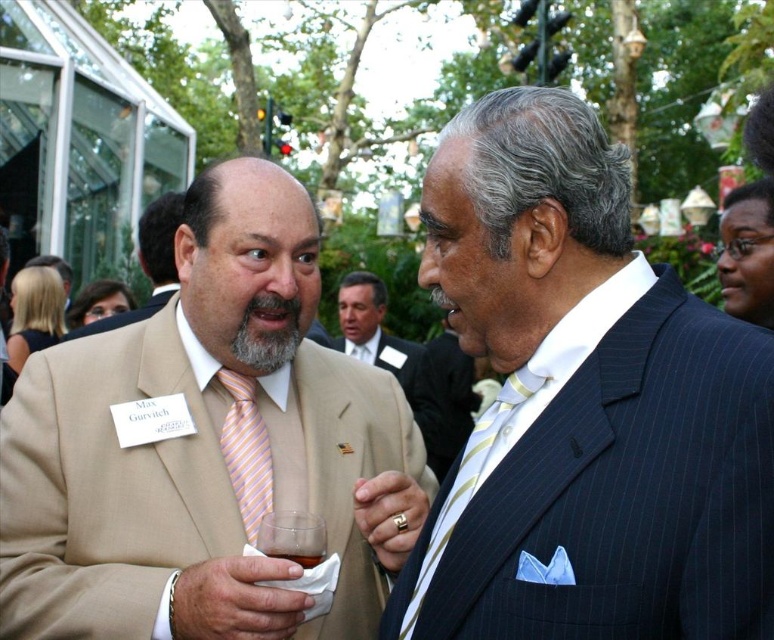
Question: Which of these objects is positioned farthest from the beige suit at center?

Choices:
 (A) striped silk tie at center
 (B) beige fabric suit at left

Answer: (A)

Question: Does graysoftbeard at center come in front of translucent plastic cup at lower center?

Choices:
 (A) yes
 (B) no

Answer: (B)

Question: Can you confirm if graysoftbeard at center is smaller than translucent plastic cup at lower center?

Choices:
 (A) yes
 (B) no

Answer: (B)

Question: Which object is positioned closest to the translucent plastic cup at lower center?

Choices:
 (A) tan fabric suit at center
 (B) striped silk tie at center
 (C) beige fabric suit at left
 (D) light brown suit at center

Answer: (B)

Question: Which of these objects is positioned closest to the light brown suit at center?

Choices:
 (A) beige suit at center
 (B) tan fabric suit at center

Answer: (A)

Question: Does beige suit at center have a greater width compared to graysoftbeard at center?

Choices:
 (A) yes
 (B) no

Answer: (A)